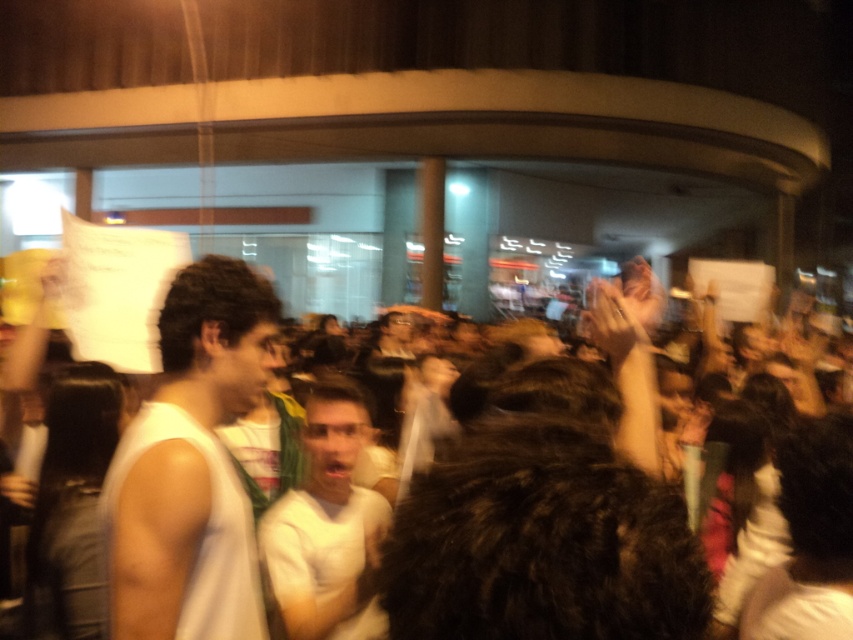
You are a photographer at the event and want to capture a closeup of the white fur coat at center and white fabric shirt at center. Which one should you focus on if you want to ensure both are fully visible in the frame without cropping?

The white fur coat at center might be wider than the white fabric shirt at center, so focusing on the white fur coat at center would ensure both are fully visible since it is wider and likely occupies more space.

You are a photographer at the event and want to capture a photo of both the white fur coat at center and the white fabric shirt at center in the same frame. Which one is positioned to the right of the other?

The white fur coat at center is positioned on the right side of white fabric shirt at center.

Based on the photo, you are a photographer trying to capture a clear shot of the crowd. You notice two white items at the center of the scene. Which one is taller between the white fur coat at center and the white fabric shirt at center?

The white fur coat at center is taller than the white fabric shirt at center according to the description.